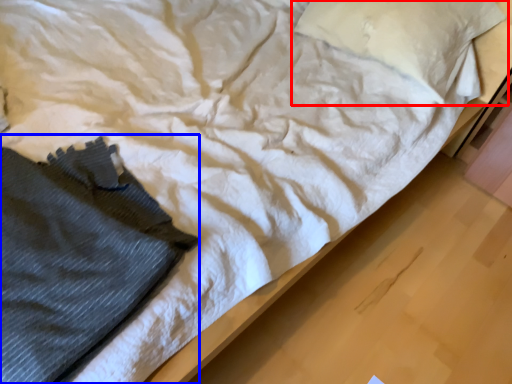
Question: Which point is closer to the camera, pillow (highlighted by a red box) or clothing (highlighted by a blue box)?

Choices:
 (A) pillow
 (B) clothing

Answer: (B)